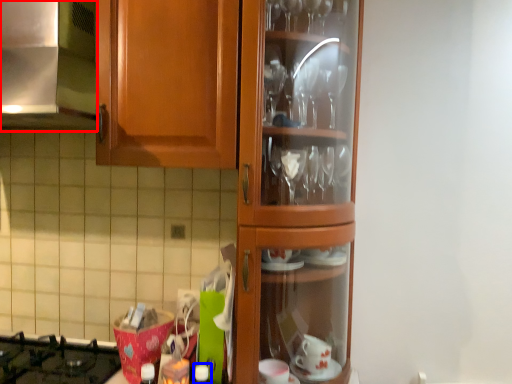
Question: Among these objects, which one is nearest to the camera, exhaust hood (highlighted by a red box) or bottle (highlighted by a blue box)?

Choices:
 (A) exhaust hood
 (B) bottle

Answer: (A)